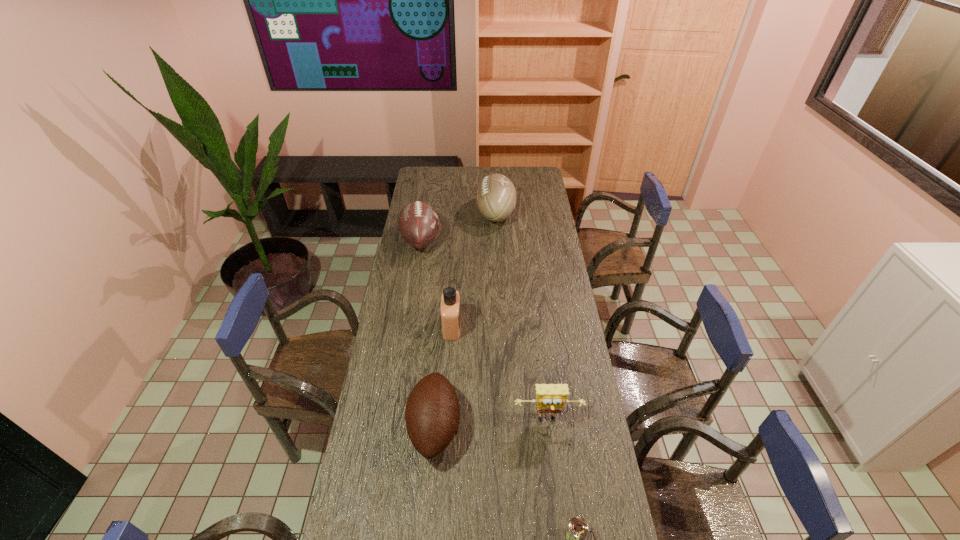
Where is `object that is the third closest to the nearest football`? This screenshot has height=540, width=960. object that is the third closest to the nearest football is located at coordinates (577, 529).

Where is `object that is the fourth closest one to the rightmost football`? object that is the fourth closest one to the rightmost football is located at coordinates (550, 398).

Select which football appears as the second closest to the nearest football. Please provide its 2D coordinates. Your answer should be formatted as a tuple, i.e. [(x, y)], where the tuple contains the x and y coordinates of a point satisfying the conditions above.

[(496, 196)]

Where is `football that can be found as the second closest to the sponge`? football that can be found as the second closest to the sponge is located at coordinates (418, 223).

This screenshot has width=960, height=540. I want to click on free space that satisfies the following two spatial constraints: 1. on the face of the sponge; 2. on the laces of the nearest football, so click(548, 427).